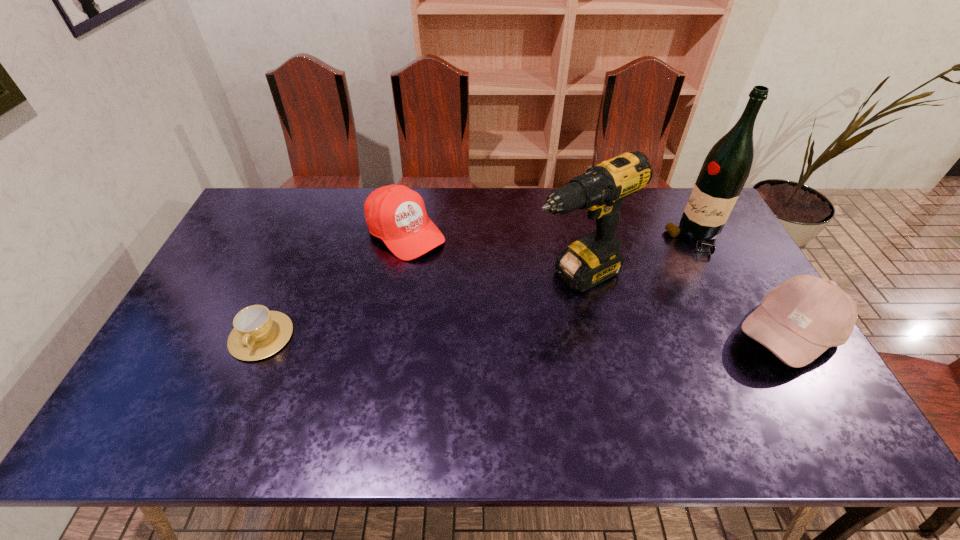
What are the coordinates of `free space between the drill and the leftmost object` in the screenshot? It's located at (419, 306).

Where is `free space between the fourth object from right to left and the tallest object`? free space between the fourth object from right to left and the tallest object is located at coordinates (550, 235).

At what (x,y) coordinates should I click in order to perform the action: click on free space between the drill and the wine bottle. Please return your answer as a coordinate pair (x, y). The height and width of the screenshot is (540, 960). Looking at the image, I should click on (636, 256).

Identify the location of free space between the fourth object from right to left and the fourth shortest object. The width and height of the screenshot is (960, 540). (491, 254).

This screenshot has height=540, width=960. I want to click on vacant area that lies between the nearer baseball cap and the tallest object, so click(x=741, y=286).

This screenshot has width=960, height=540. I want to click on free space between the third object from right to left and the left baseball cap, so click(x=491, y=254).

This screenshot has width=960, height=540. Find the location of `blank region between the third object from left to right and the right baseball cap`. blank region between the third object from left to right and the right baseball cap is located at coordinates (682, 305).

I want to click on free space between the shortest object and the farther baseball cap, so click(333, 284).

This screenshot has width=960, height=540. I want to click on vacant space in between the leftmost object and the drill, so click(419, 306).

Select which object appears as the fourth closest to the shortest object. Please provide its 2D coordinates. Your answer should be formatted as a tuple, i.e. [(x, y)], where the tuple contains the x and y coordinates of a point satisfying the conditions above.

[(800, 319)]